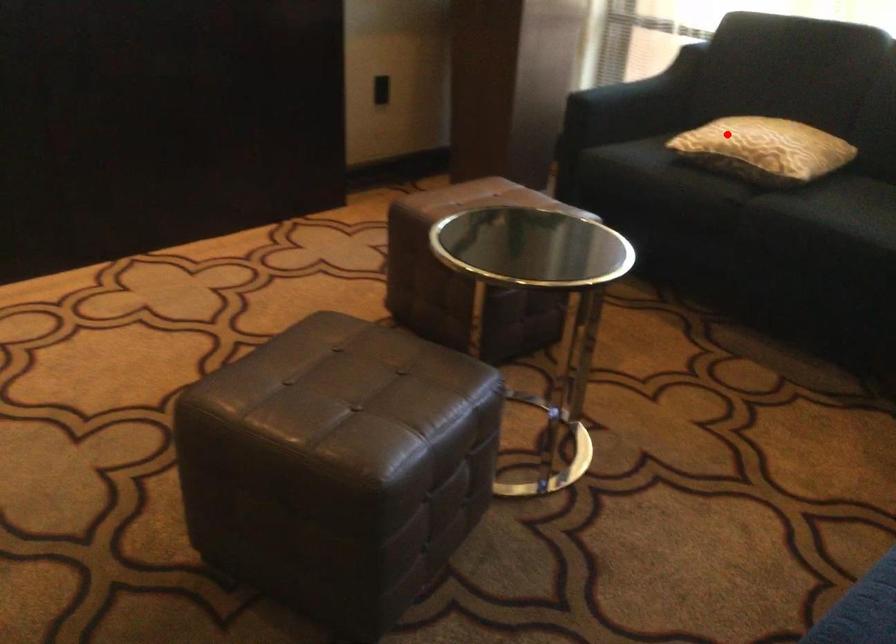
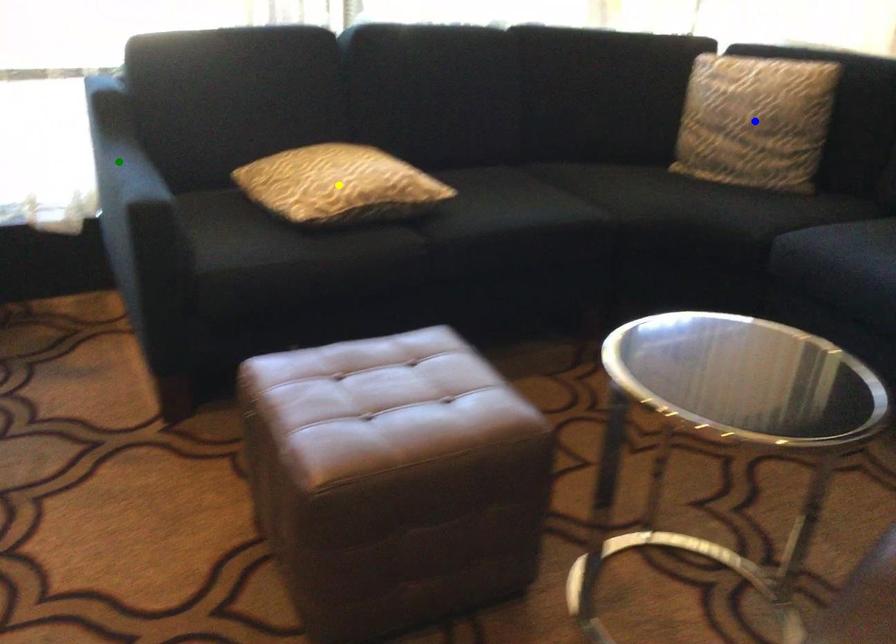
Question: I am providing you with two images of the same scene from different viewpoints. A red point is marked on the first image. You are given multiple points on the second image. Which point in image 2 is actually the same real-world point as the red point in image 1?

Choices:
 (A) yellow point
 (B) blue point
 (C) green point

Answer: (A)